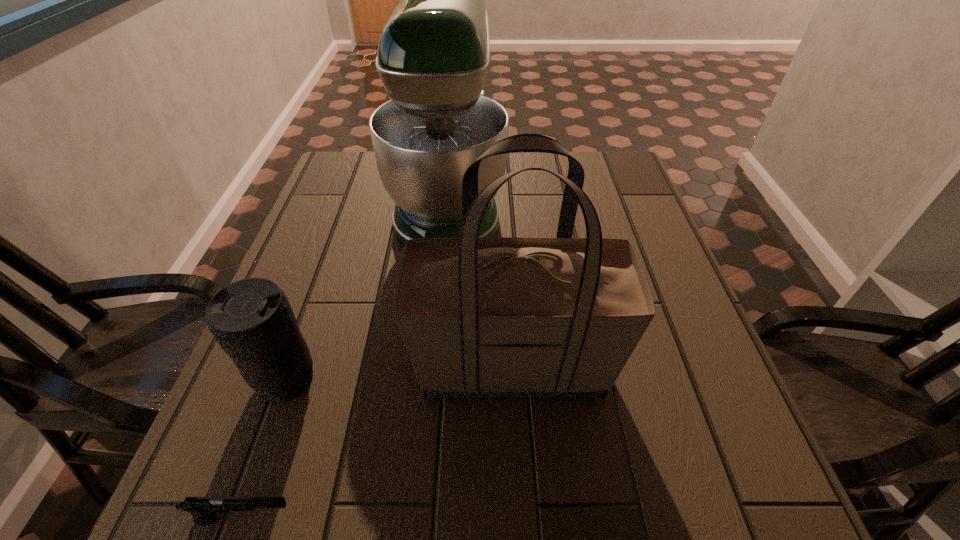
This screenshot has width=960, height=540. Identify the location of blank area located 0.240m at the aiming end of the gun. (455, 519).

At what (x,y) coordinates should I click in order to perform the action: click on object present at the far edge. Please return your answer as a coordinate pair (x, y). Looking at the image, I should click on (432, 58).

This screenshot has width=960, height=540. I want to click on object that is at the near edge, so click(x=204, y=509).

You are a GUI agent. You are given a task and a screenshot of the screen. Output one action in this format:
    pyautogui.click(x=<x>, y=<y>)
    Task: Click on the telephoto lens that is at the left edge
    
    Given the screenshot: What is the action you would take?
    pyautogui.click(x=251, y=319)

Identify the location of gun located at the left edge. (204, 509).

Find the location of a particular element. object situated at the near left corner is located at coordinates (204, 509).

At what (x,y) coordinates should I click in order to perform the action: click on vacant point at the far edge. Please return your answer as a coordinate pair (x, y). The height and width of the screenshot is (540, 960). Looking at the image, I should click on (526, 163).

You are a GUI agent. You are given a task and a screenshot of the screen. Output one action in this format:
    pyautogui.click(x=<x>, y=<y>)
    Task: Click on the free space at the near edge of the desktop
    
    Given the screenshot: What is the action you would take?
    pyautogui.click(x=423, y=475)

Where is `free region at the left edge of the desktop`? free region at the left edge of the desktop is located at coordinates (328, 351).

This screenshot has width=960, height=540. Identify the location of vacant region at the right edge of the desktop. (698, 362).